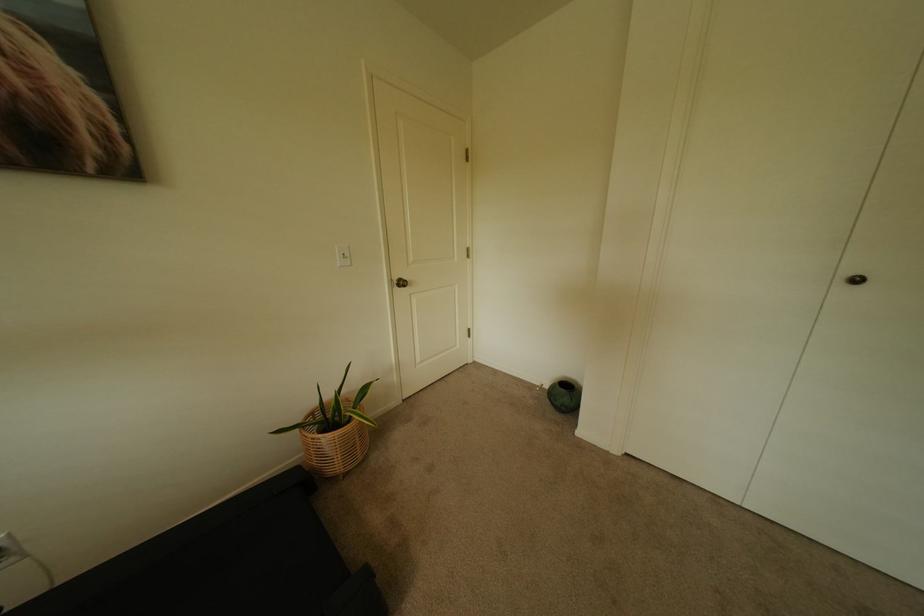
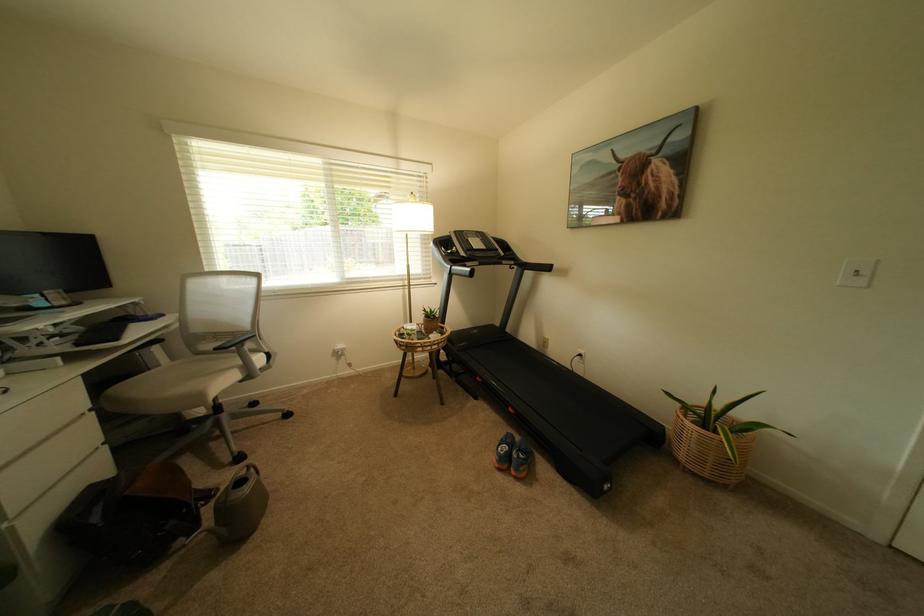
Where in the second image is the point corresponding to (351,254) from the first image?

(866, 272)